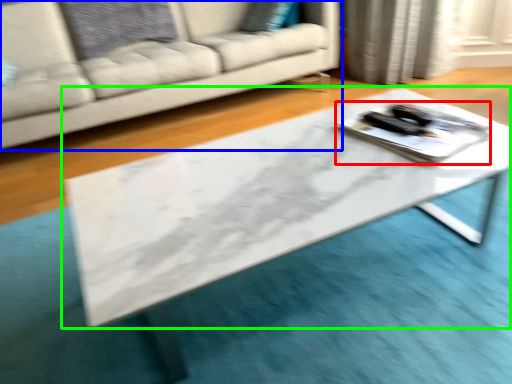
Question: Estimate the real-world distances between objects in this image. Which object is farther from tray (highlighted by a red box), studio couch (highlighted by a blue box) or table (highlighted by a green box)?

Choices:
 (A) studio couch
 (B) table

Answer: (A)